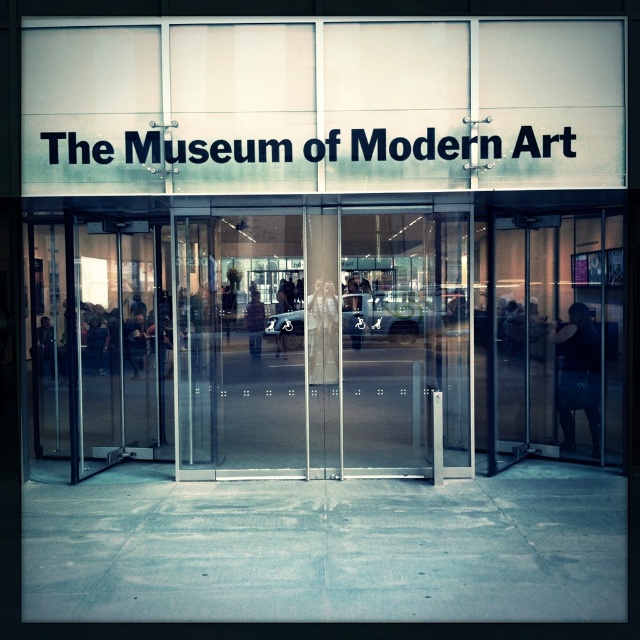
Question: Estimate the real-world distances between objects in this image. Which object is farther from the dark brown leather jacket at center?

Choices:
 (A) transparent glass doors at center
 (B) black fabric at right

Answer: (B)

Question: Which of the following is the farthest from the observer?

Choices:
 (A) (260, 323)
 (B) (589, 371)
 (C) (544, 424)

Answer: (C)

Question: Among these points, which one is farthest from the camera?

Choices:
 (A) (484, 467)
 (B) (579, 364)
 (C) (257, 340)

Answer: (B)

Question: Is black fabric at right behind dark brown leather jacket at center?

Choices:
 (A) no
 (B) yes

Answer: (B)

Question: Can you confirm if transparent glass doors at center is positioned above black fabric at right?

Choices:
 (A) no
 (B) yes

Answer: (B)

Question: In this image, where is transparent glass doors at center located relative to black fabric at right?

Choices:
 (A) right
 (B) left

Answer: (B)